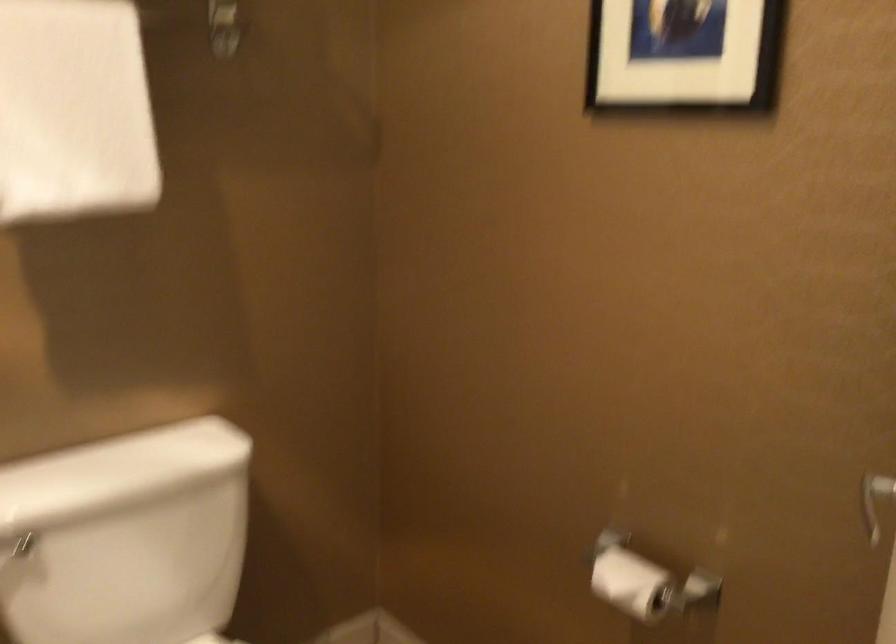
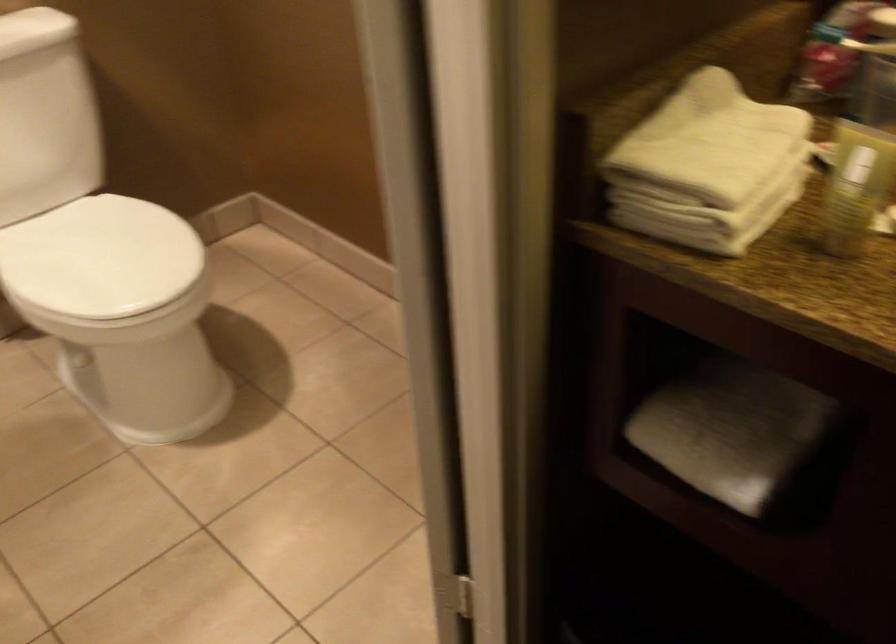
Question: The first image is from the beginning of the video and the second image is from the end. How did the camera likely rotate when shooting the video?

Choices:
 (A) Left
 (B) Right
 (C) Up
 (D) Down

Answer: (D)